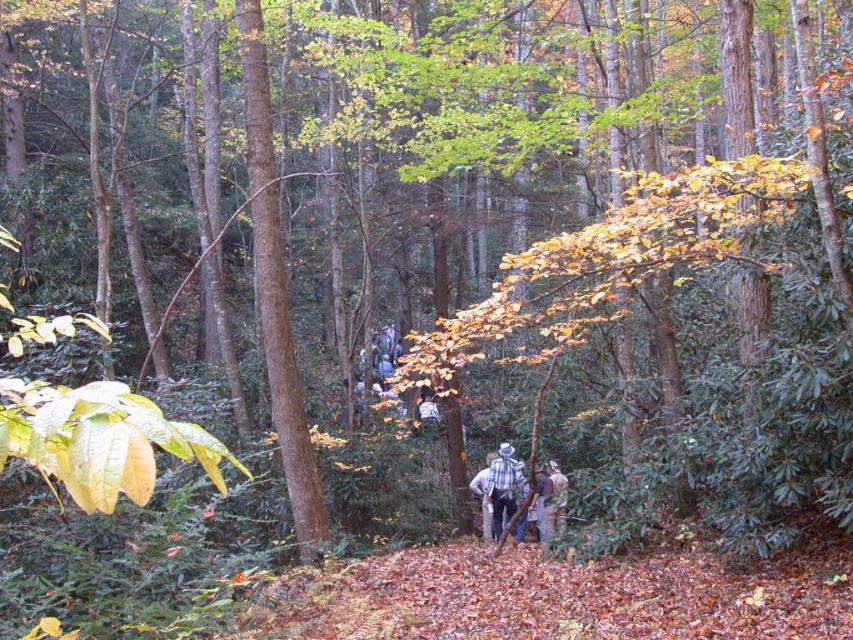
Question: Among these objects, which one is nearest to the camera?

Choices:
 (A) plaid shirt at center
 (B) plaid flannel shirt at center

Answer: (A)

Question: Can you confirm if plaid shirt at center is smaller than plaid flannel shirt at center?

Choices:
 (A) yes
 (B) no

Answer: (B)

Question: Does plaid shirt at center come behind plaid flannel shirt at center?

Choices:
 (A) yes
 (B) no

Answer: (B)

Question: Does plaid shirt at center have a greater width compared to plaid flannel shirt at center?

Choices:
 (A) no
 (B) yes

Answer: (B)

Question: Which object appears closest to the camera in this image?

Choices:
 (A) plaid shirt at center
 (B) plaid flannel shirt at center

Answer: (A)